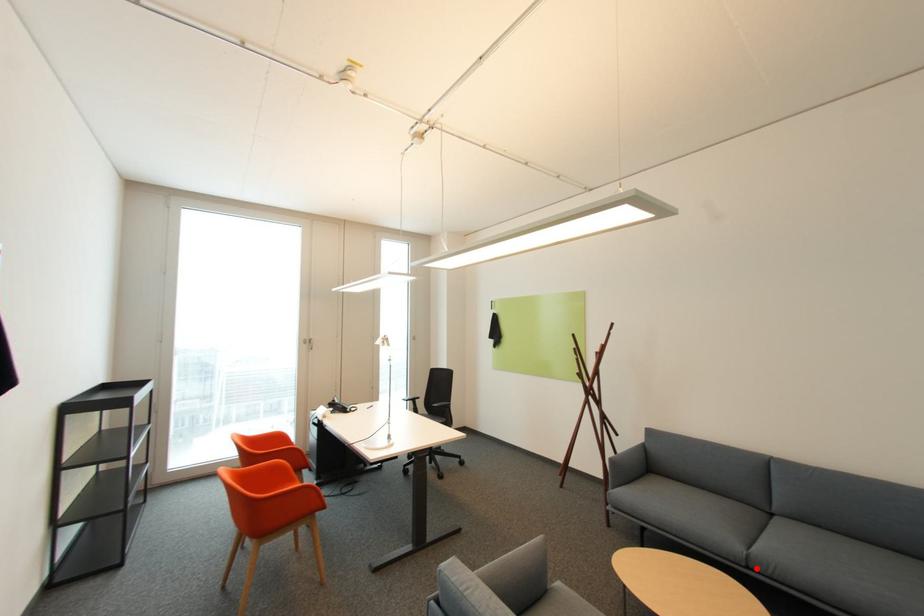
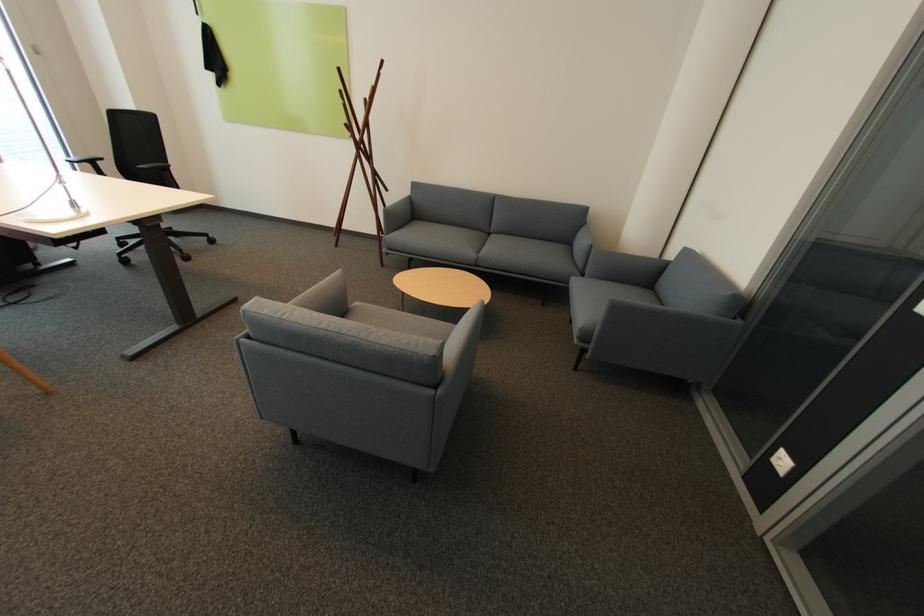
Where in the second image is the point corresponding to the highlighted location from the first image?

(482, 265)